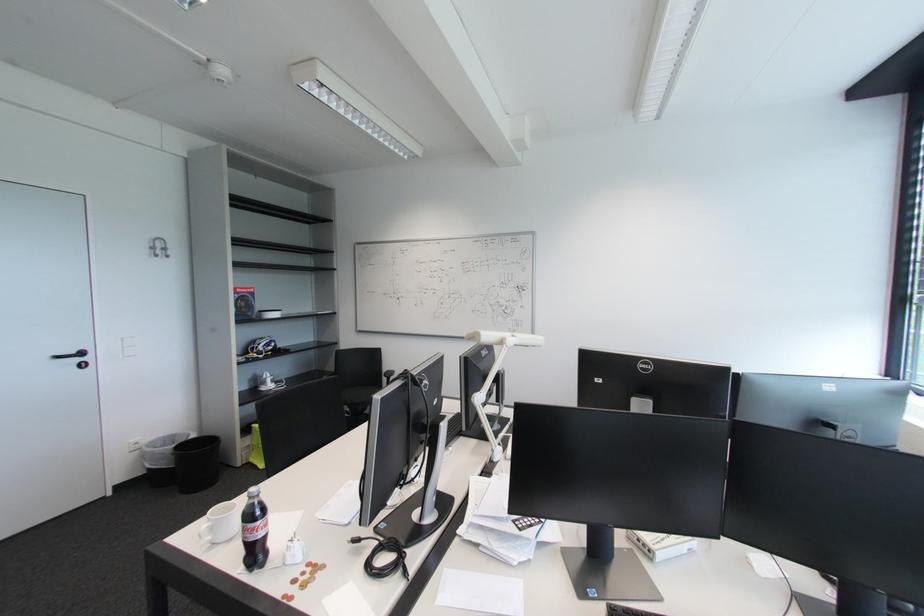
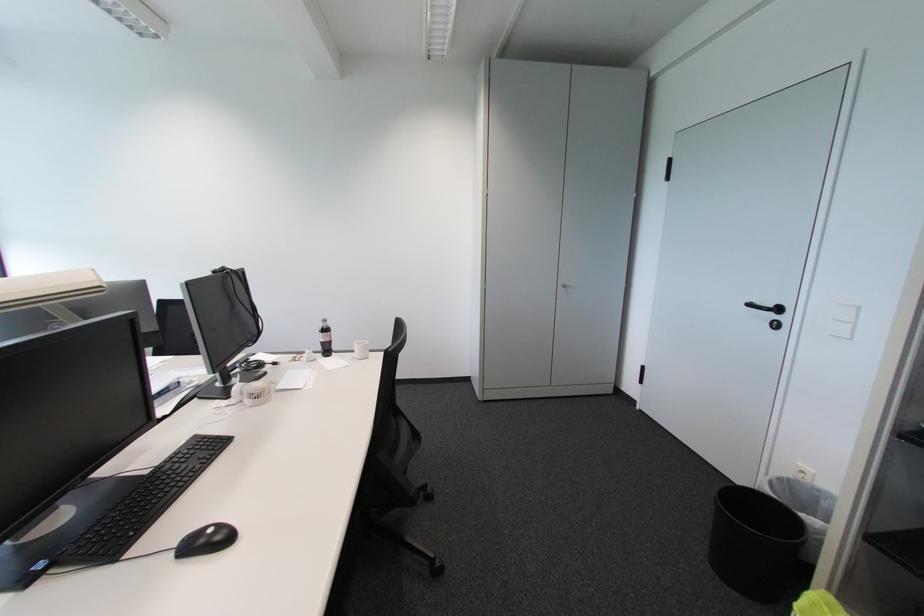
Locate, in the second image, the point that corresponds to point 141,447 in the first image.

(809, 477)